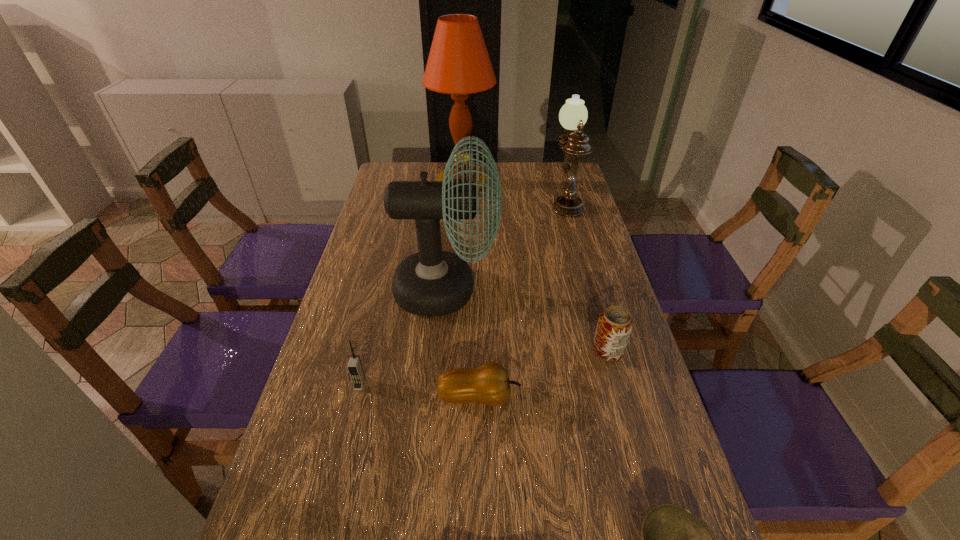
The height and width of the screenshot is (540, 960). I want to click on vacant area between the lamp and the fan, so click(447, 239).

I want to click on vacant point located between the gourd and the fourth nearest object, so click(543, 374).

Identify which object is the second nearest to the cellular telephone. Please provide its 2D coordinates. Your answer should be formatted as a tuple, i.e. [(x, y)], where the tuple contains the x and y coordinates of a point satisfying the conditions above.

[(489, 384)]

Locate which object is the closest to the cellular telephone. Please provide its 2D coordinates. Your answer should be formatted as a tuple, i.e. [(x, y)], where the tuple contains the x and y coordinates of a point satisfying the conditions above.

[(432, 282)]

Find the location of `free space that satisfies the following two spatial constraints: 1. in front of the beer can where the airflow is directed; 2. on the right side of the fan`. free space that satisfies the following two spatial constraints: 1. in front of the beer can where the airflow is directed; 2. on the right side of the fan is located at coordinates (441, 350).

The image size is (960, 540). Find the location of `free location that satisfies the following two spatial constraints: 1. in front of the second tallest object where the airflow is directed; 2. on the front-facing side of the cellular telephone`. free location that satisfies the following two spatial constraints: 1. in front of the second tallest object where the airflow is directed; 2. on the front-facing side of the cellular telephone is located at coordinates (438, 384).